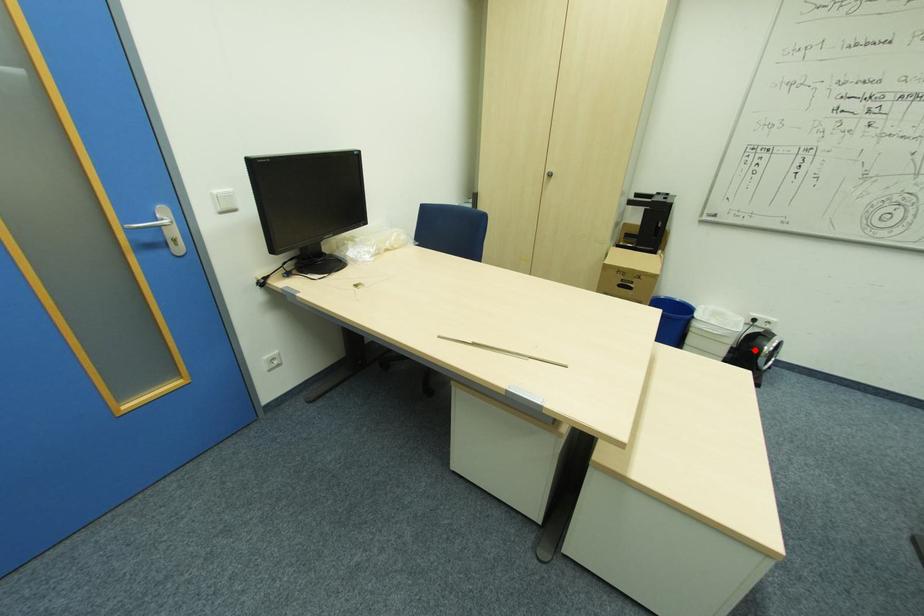
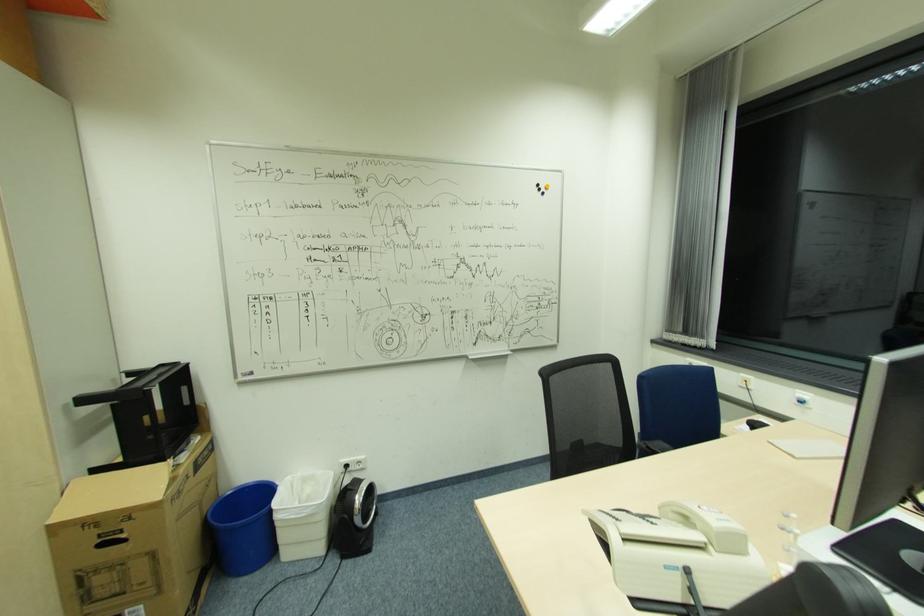
Question: I am providing you with two images of the same scene from different viewpoints. Image1 has a red point marked. In image2, the corresponding 3D location appears at what relative position? Reply with the corresponding letter.

Choices:
 (A) Closer
 (B) Farther

Answer: (B)